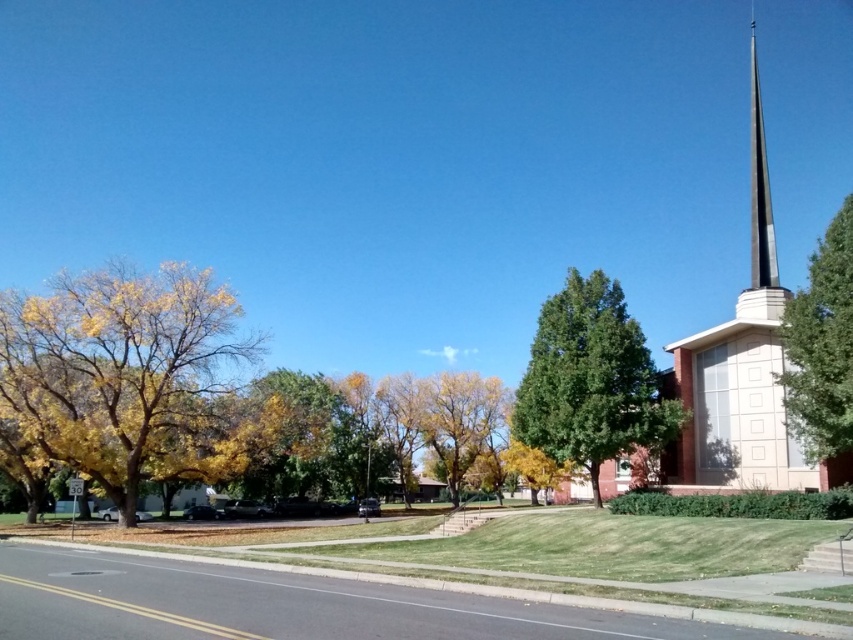
Question: Which point is farther to the camera?

Choices:
 (A) (611, 436)
 (B) (459, 451)

Answer: (B)

Question: Can you confirm if green leafy tree at center is positioned above shiny silver spire at upper right?

Choices:
 (A) yes
 (B) no

Answer: (B)

Question: Which of these objects is positioned farthest from the shiny silver spire at upper right?

Choices:
 (A) yellow leafy tree at left
 (B) green leafy tree at upper right
 (C) yellow-green leaves at center
 (D) smooth tan steeple at right

Answer: (B)

Question: Does green leafy tree at center appear on the left side of yellow leafy tree at center?

Choices:
 (A) no
 (B) yes

Answer: (A)

Question: Which object is positioned farthest from the green leafy tree at upper right?

Choices:
 (A) yellow leafy tree at left
 (B) shiny silver spire at upper right
 (C) green leafy tree at center
 (D) smooth tan steeple at right

Answer: (B)

Question: Can you confirm if green leafy tree at upper right is thinner than yellow leafy tree at center?

Choices:
 (A) no
 (B) yes

Answer: (A)